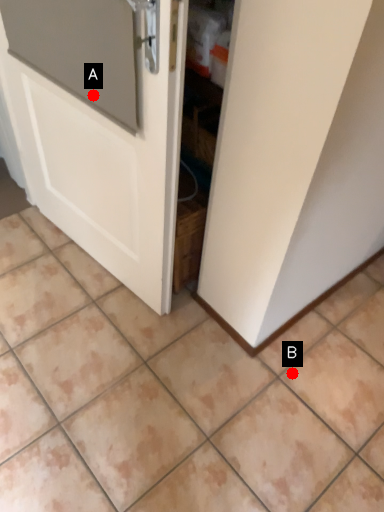
Question: Two points are circled on the image, labeled by A and B beside each circle. Among these points, which one is farthest from the camera?

Choices:
 (A) A is further
 (B) B is further

Answer: (B)